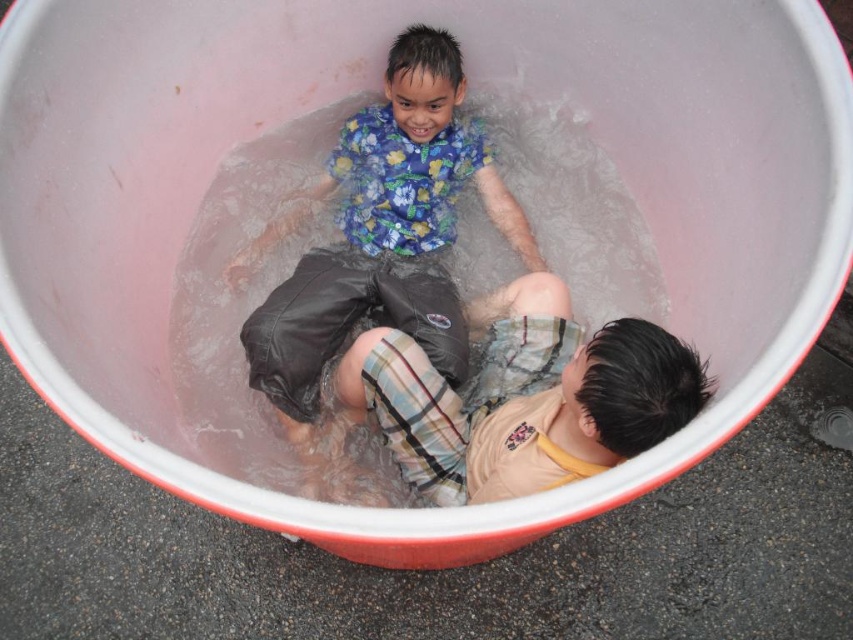
You are a photographer trying to capture a photo of both the floral fabric shirt at upper center and the plaid cotton shorts at lower right. Which object should you focus on first if you want to ensure both are in the frame without moving the camera?

You should focus on the floral fabric shirt at upper center first because it is positioned on the left side of the plaid cotton shorts at lower right, ensuring both are within the frame when centered on the leftmost object.

You are a photographer trying to capture both the floral fabric shirt at upper center and the plaid cotton shorts at lower right in a single frame. Based on their sizes, which one should you focus on to ensure they both fit in the photo?

The floral fabric shirt at upper center is wider than the plaid cotton shorts at lower right, so focusing on the shirt will help ensure both fit in the photo since it takes up more space.